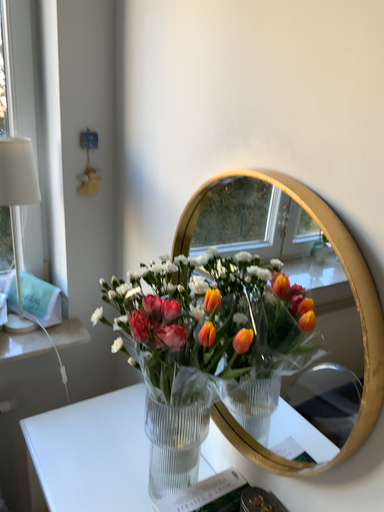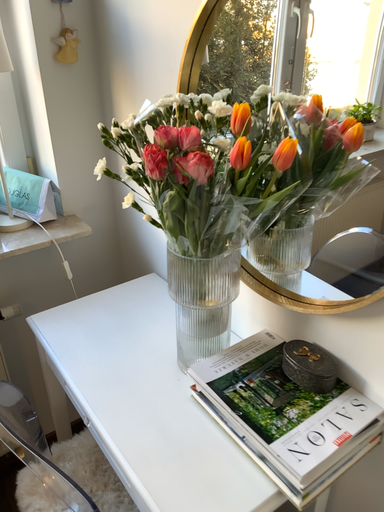
Question: Which way did the camera rotate in the video?

Choices:
 (A) rotated upward
 (B) rotated downward

Answer: (B)